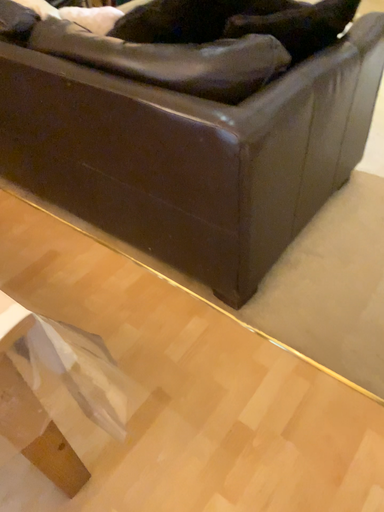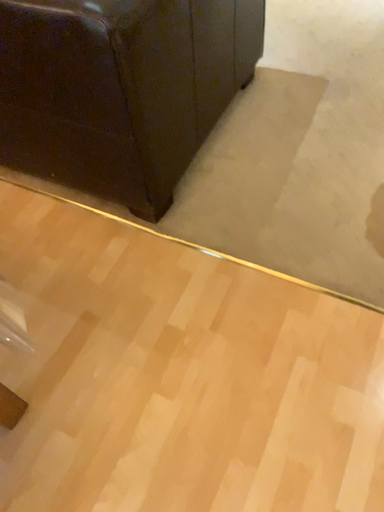
Question: Which way did the camera rotate in the video?

Choices:
 (A) rotated upward
 (B) rotated downward

Answer: (B)